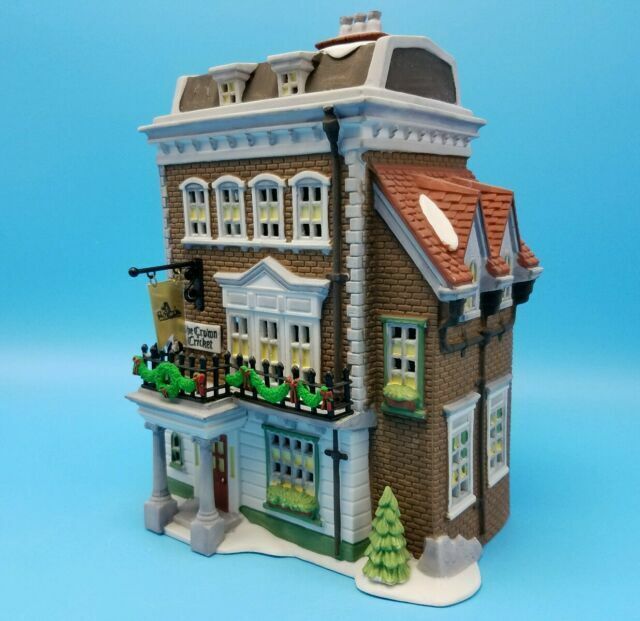
Find the location of a particular element. grey pillars is located at coordinates (205, 515), (155, 502).